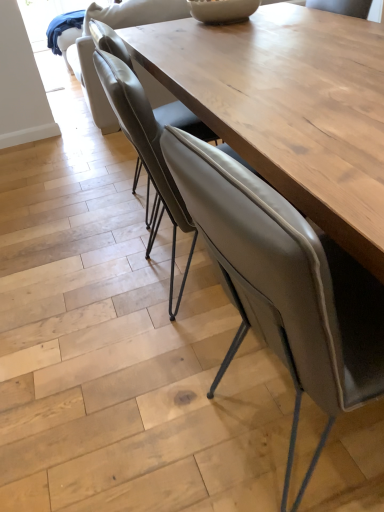
Find the location of `matte gray chair at center, positioned as the second chair in back-to-front order`. matte gray chair at center, positioned as the second chair in back-to-front order is located at coordinates (146, 153).

In order to face leather-like beige chair at center, the first chair in the back-to-front sequence, should I rotate leftwards or rightwards?

To align with it, rotate left about 2.603°.

What is the approximate height of leather armchair at upper center?

leather armchair at upper center is 36.01 inches in height.

Image resolution: width=384 pixels, height=512 pixels. I want to click on matte gray chair at center, the 2th chair from the front, so tap(146, 153).

Considering the sizes of matte gray chair at center, the 2th chair from the front, and matte gray chair at center, the 1th chair when ordered from front to back, in the image, is matte gray chair at center, the 2th chair from the front, bigger or smaller than matte gray chair at center, the 1th chair when ordered from front to back,?

Considering their sizes, matte gray chair at center, the 2th chair from the front, takes up less space than matte gray chair at center, the 1th chair when ordered from front to back.

Would you say matte gray chair at center, which appears as the 3th chair when viewed from the back, is part of matte gray chair at center, the 2th chair from the front,'s contents?

No, matte gray chair at center, which appears as the 3th chair when viewed from the back, is not inside matte gray chair at center, the 2th chair from the front.

Based on the photo, from a real-world perspective, is matte gray chair at center, positioned as the second chair in back-to-front order, above or below matte gray chair at center, which appears as the 3th chair when viewed from the back?

matte gray chair at center, positioned as the second chair in back-to-front order, is above matte gray chair at center, which appears as the 3th chair when viewed from the back.

Is point (149, 140) less distant than point (246, 213)?

No, it is not.

Which of these two, leather armchair at upper center or matte gray chair at center, the 2th chair from the front, is wider?

Wider between the two is leather armchair at upper center.

Based on their positions, is leather armchair at upper center located to the left or right of matte gray chair at center, the 2th chair from the front?

From the image, it's evident that leather armchair at upper center is to the left of matte gray chair at center, the 2th chair from the front.

From the image's perspective, who appears lower, leather armchair at upper center or matte gray chair at center, positioned as the second chair in back-to-front order?

matte gray chair at center, positioned as the second chair in back-to-front order, is shown below in the image.

Is leather armchair at upper center behind matte gray chair at center, positioned as the second chair in back-to-front order?

That is True.

Starting from the leather-like beige chair at center, arranged as the third chair when viewed from the front, which chair is the 2nd one in front? Please provide its 2D coordinates.

[(284, 284)]

Who is taller, leather-like beige chair at center, arranged as the third chair when viewed from the front, or matte gray chair at center, the 1th chair when ordered from front to back?

matte gray chair at center, the 1th chair when ordered from front to back, is taller.

Is leather-like beige chair at center, arranged as the third chair when viewed from the front, next to matte gray chair at center, the 1th chair when ordered from front to back, and touching it?

No, leather-like beige chair at center, arranged as the third chair when viewed from the front, is not touching matte gray chair at center, the 1th chair when ordered from front to back.

From the image's perspective, between leather-like beige chair at center, arranged as the third chair when viewed from the front, and matte gray chair at center, which appears as the 3th chair when viewed from the back, which one is located above?

leather-like beige chair at center, arranged as the third chair when viewed from the front, from the image's perspective.

Image resolution: width=384 pixels, height=512 pixels. Find the location of `the 2nd chair counting from the left side of the matte gray chair at center, the 1th chair when ordered from front to back`. the 2nd chair counting from the left side of the matte gray chair at center, the 1th chair when ordered from front to back is located at coordinates pos(142,116).

Based on the photo, does matte gray chair at center, the 1th chair when ordered from front to back, have a lesser height compared to leather-like beige chair at center, the first chair in the back-to-front sequence?

In fact, matte gray chair at center, the 1th chair when ordered from front to back, may be taller than leather-like beige chair at center, the first chair in the back-to-front sequence.

Looking at the image, does matte gray chair at center, the 1th chair when ordered from front to back, seem bigger or smaller compared to leather-like beige chair at center, the first chair in the back-to-front sequence?

In the image, matte gray chair at center, the 1th chair when ordered from front to back, appears to be larger than leather-like beige chair at center, the first chair in the back-to-front sequence.

Does matte gray chair at center, which appears as the 3th chair when viewed from the back, turn towards leather-like beige chair at center, the first chair in the back-to-front sequence?

No, matte gray chair at center, which appears as the 3th chair when viewed from the back, is not facing towards leather-like beige chair at center, the first chair in the back-to-front sequence.

Is leather armchair at upper center positioned beyond the bounds of leather-like beige chair at center, the first chair in the back-to-front sequence?

Yes, leather armchair at upper center is outside of leather-like beige chair at center, the first chair in the back-to-front sequence.

Considering the relative sizes of leather armchair at upper center and leather-like beige chair at center, the first chair in the back-to-front sequence, in the image provided, is leather armchair at upper center smaller than leather-like beige chair at center, the first chair in the back-to-front sequence,?

Incorrect, leather armchair at upper center is not smaller in size than leather-like beige chair at center, the first chair in the back-to-front sequence.

Starting from the leather armchair at upper center, which chair is the 1st one to the right? Please provide its 2D coordinates.

[(142, 116)]

From a real-world perspective, does leather armchair at upper center sit lower than leather-like beige chair at center, the first chair in the back-to-front sequence?

Incorrect, from a real-world perspective, leather armchair at upper center is higher than leather-like beige chair at center, the first chair in the back-to-front sequence.

Is leather-like beige chair at center, arranged as the third chair when viewed from the front, inside the boundaries of matte gray chair at center, positioned as the second chair in back-to-front order, or outside?

The correct answer is: outside.

Is leather-like beige chair at center, the first chair in the back-to-front sequence, facing away from matte gray chair at center, positioned as the second chair in back-to-front order?

No, leather-like beige chair at center, the first chair in the back-to-front sequence, is not facing the opposite direction of matte gray chair at center, positioned as the second chair in back-to-front order.

Considering the relative sizes of leather-like beige chair at center, arranged as the third chair when viewed from the front, and matte gray chair at center, positioned as the second chair in back-to-front order, in the image provided, is leather-like beige chair at center, arranged as the third chair when viewed from the front, shorter than matte gray chair at center, positioned as the second chair in back-to-front order,?

Yes, leather-like beige chair at center, arranged as the third chair when viewed from the front, is shorter than matte gray chair at center, positioned as the second chair in back-to-front order.

Which point is more forward, (294, 309) or (164, 192)?

The point (294, 309) is more forward.

How far apart are matte gray chair at center, the 1th chair when ordered from front to back, and matte gray chair at center, positioned as the second chair in back-to-front order?

matte gray chair at center, the 1th chair when ordered from front to back, and matte gray chair at center, positioned as the second chair in back-to-front order, are 19.96 inches apart.

Who is more distant, matte gray chair at center, the 1th chair when ordered from front to back, or matte gray chair at center, the 2th chair from the front?

matte gray chair at center, the 2th chair from the front.

How different are the orientations of matte gray chair at center, the 1th chair when ordered from front to back, and matte gray chair at center, the 2th chair from the front, in degrees?

5.51 degrees.

This screenshot has height=512, width=384. What are the coordinates of `chair that is the 1st object located behind the matte gray chair at center, the 1th chair when ordered from front to back` in the screenshot? It's located at (146, 153).

From the image's perspective, starting from the leather armchair at upper center, which chair is the 2nd one below? Please provide its 2D coordinates.

[(146, 153)]

Looking at the image, which one is located further to matte gray chair at center, the 1th chair when ordered from front to back, leather-like beige chair at center, arranged as the third chair when viewed from the front, or leather armchair at upper center?

The object further to matte gray chair at center, the 1th chair when ordered from front to back, is leather armchair at upper center.

Which object lies nearer to the anchor point leather armchair at upper center, matte gray chair at center, positioned as the second chair in back-to-front order, or leather-like beige chair at center, the first chair in the back-to-front sequence?

Among the two, leather-like beige chair at center, the first chair in the back-to-front sequence, is located nearer to leather armchair at upper center.

Which object lies further to the anchor point leather-like beige chair at center, arranged as the third chair when viewed from the front, leather armchair at upper center or matte gray chair at center, the 1th chair when ordered from front to back?

leather armchair at upper center lies further to leather-like beige chair at center, arranged as the third chair when viewed from the front, than the other object.

Looking at the image, which one is located closer to matte gray chair at center, the 1th chair when ordered from front to back, matte gray chair at center, the 2th chair from the front, or leather armchair at upper center?

matte gray chair at center, the 2th chair from the front, is positioned closer to the anchor matte gray chair at center, the 1th chair when ordered from front to back.

Considering their positions, is leather-like beige chair at center, arranged as the third chair when viewed from the front, positioned further to matte gray chair at center, which appears as the 3th chair when viewed from the back, than matte gray chair at center, positioned as the second chair in back-to-front order?

The object further to matte gray chair at center, which appears as the 3th chair when viewed from the back, is leather-like beige chair at center, arranged as the third chair when viewed from the front.

Looking at the image, which one is located further to leather armchair at upper center, matte gray chair at center, positioned as the second chair in back-to-front order, or matte gray chair at center, the 1th chair when ordered from front to back?

matte gray chair at center, the 1th chair when ordered from front to back.

From the image, which object appears to be nearer to matte gray chair at center, positioned as the second chair in back-to-front order, matte gray chair at center, the 1th chair when ordered from front to back, or leather armchair at upper center?

The object closer to matte gray chair at center, positioned as the second chair in back-to-front order, is matte gray chair at center, the 1th chair when ordered from front to back.

Which object lies further to the anchor point leather armchair at upper center, leather-like beige chair at center, the first chair in the back-to-front sequence, or matte gray chair at center, the 1th chair when ordered from front to back?

matte gray chair at center, the 1th chair when ordered from front to back, is further to leather armchair at upper center.

Identify the location of chair between matte gray chair at center, the 2th chair from the front, and leather armchair at upper center from front to back. Image resolution: width=384 pixels, height=512 pixels. (142, 116).

Find the location of a particular element. The width and height of the screenshot is (384, 512). chair between matte gray chair at center, which appears as the 3th chair when viewed from the back, and leather-like beige chair at center, the first chair in the back-to-front sequence, in the front-back direction is located at coordinates (146, 153).